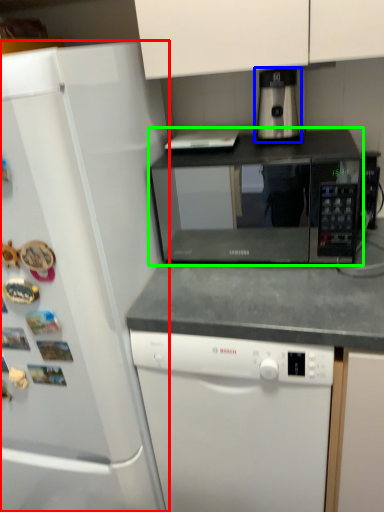
Question: Which is nearer to the refrigerator (highlighted by a red box)? coffee machine (highlighted by a blue box) or microwave oven (highlighted by a green box).

Choices:
 (A) coffee machine
 (B) microwave oven

Answer: (A)